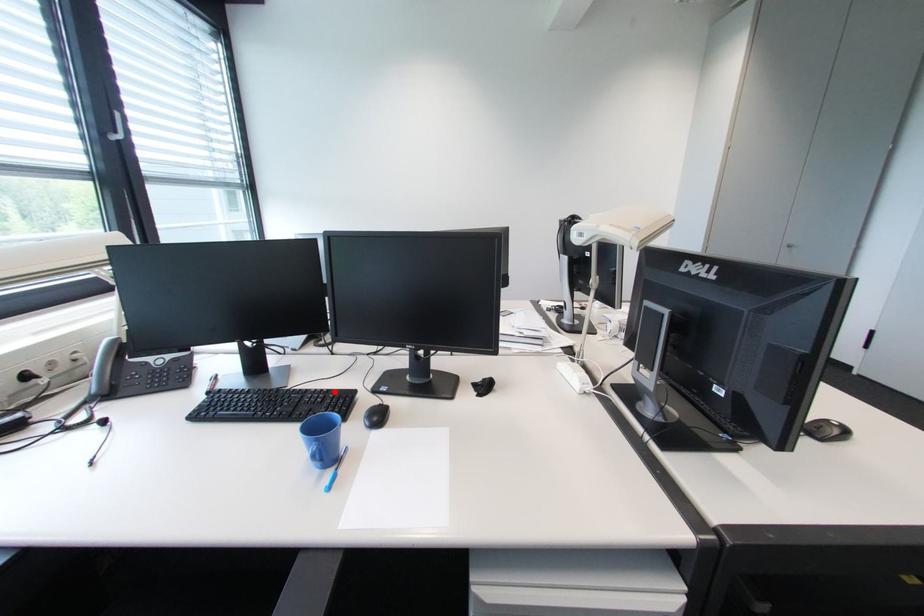
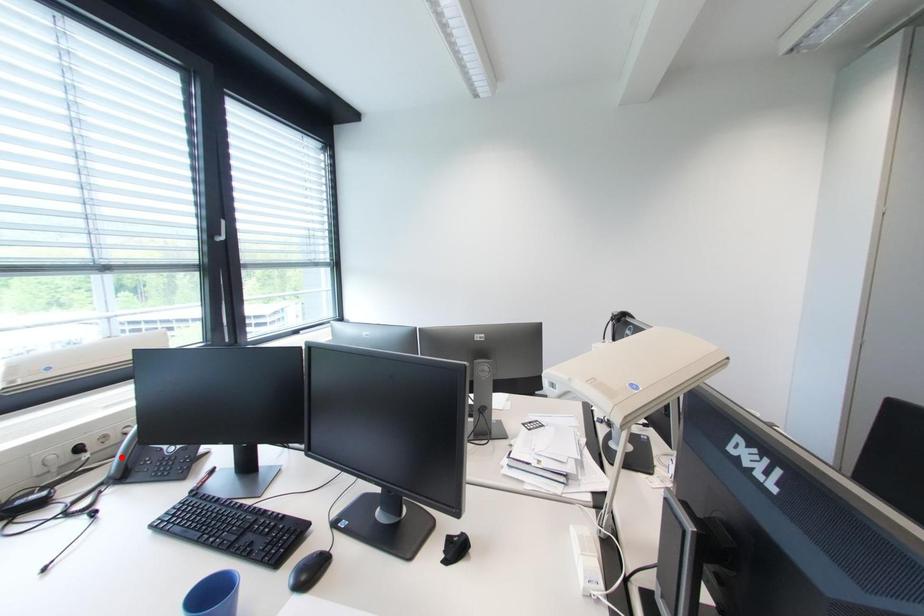
I am providing you with two images of the same scene from different viewpoints. A red point is marked on the first image and another point is marked on the second image. Are the points marked in image1 and image2 representing the same 3D position?

No